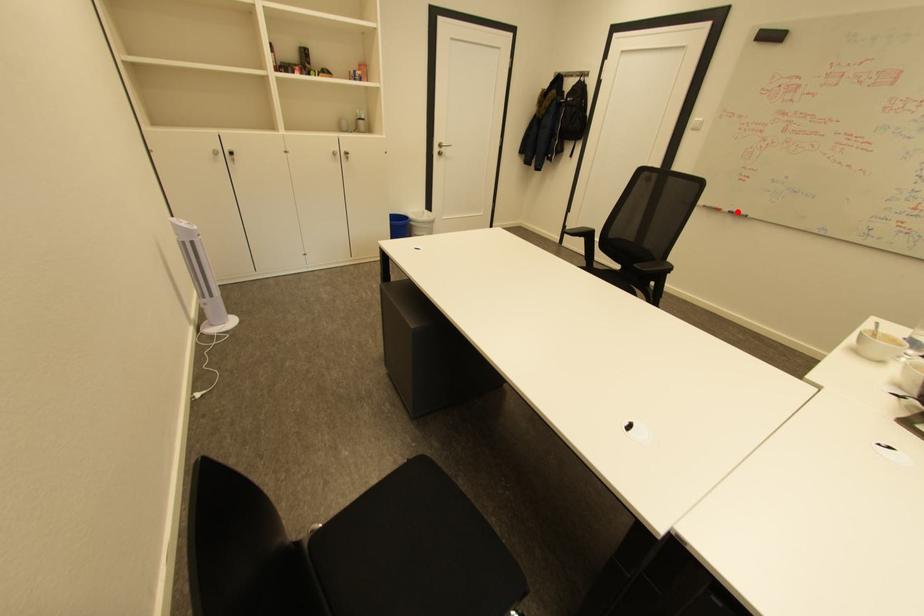
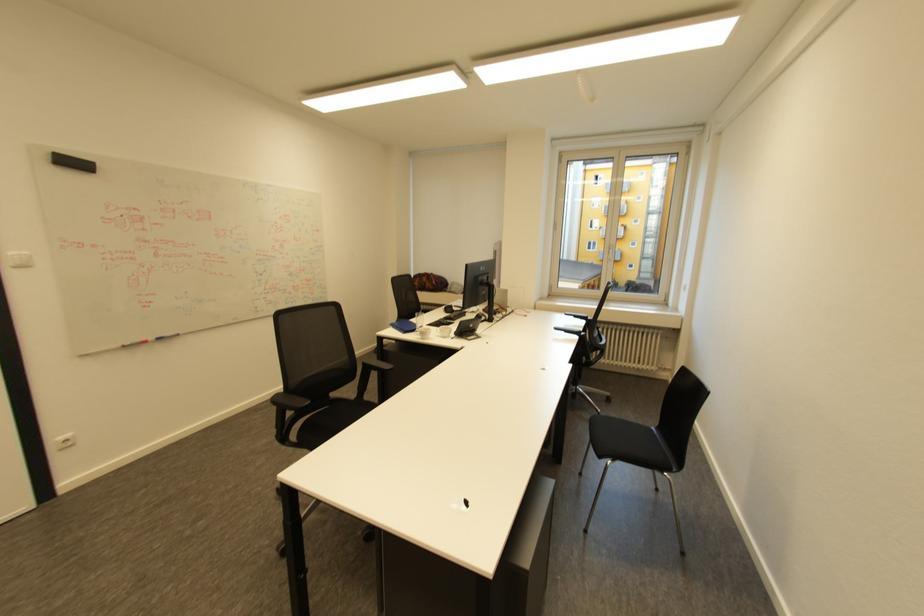
In the second image, find the point that corresponds to the highlighted location in the first image.

(164, 339)